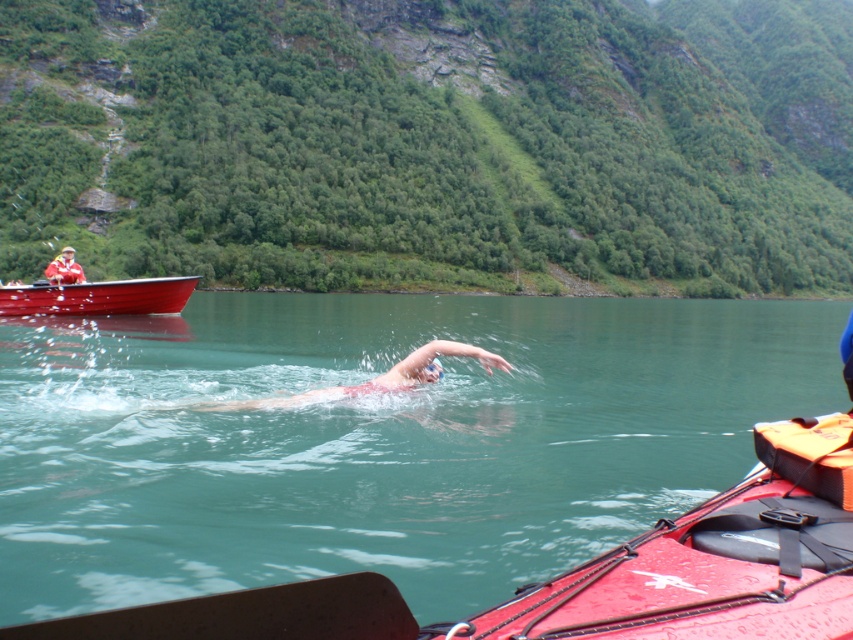
Is skinny swimmer at center wider than matte red jacket at upper left?

Incorrect, skinny swimmer at center's width does not surpass matte red jacket at upper left's.

Is skinny swimmer at center to the left of matte red jacket at upper left from the viewer's perspective?

No, skinny swimmer at center is not to the left of matte red jacket at upper left.

The width and height of the screenshot is (853, 640). Describe the element at coordinates (375, 378) in the screenshot. I see `skinny swimmer at center` at that location.

The image size is (853, 640). I want to click on skinny swimmer at center, so click(x=375, y=378).

Is green smooth water at center closer to the viewer compared to skinny swimmer at center?

Yes, green smooth water at center is in front of skinny swimmer at center.

Does green smooth water at center lie behind skinny swimmer at center?

No.

This screenshot has height=640, width=853. Find the location of `green smooth water at center`. green smooth water at center is located at coordinates (376, 440).

Does shiny red boat at left appear over skinny swimmer at center?

Correct, shiny red boat at left is located above skinny swimmer at center.

Can you confirm if shiny red boat at left is wider than skinny swimmer at center?

Yes.

The image size is (853, 640). Describe the element at coordinates (97, 298) in the screenshot. I see `shiny red boat at left` at that location.

This screenshot has width=853, height=640. In order to click on shiny red boat at left in this screenshot , I will do `click(97, 298)`.